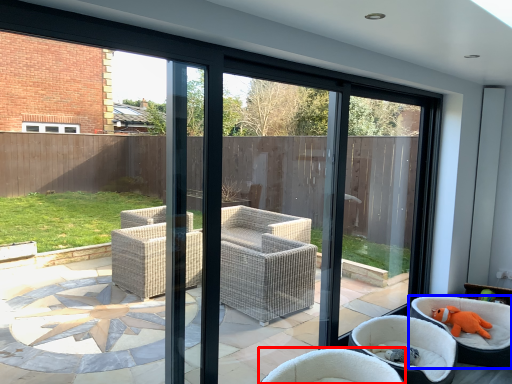
Question: Which object is closer to the camera taking this photo, chair (highlighted by a red box) or chair (highlighted by a blue box)?

Choices:
 (A) chair
 (B) chair

Answer: (A)